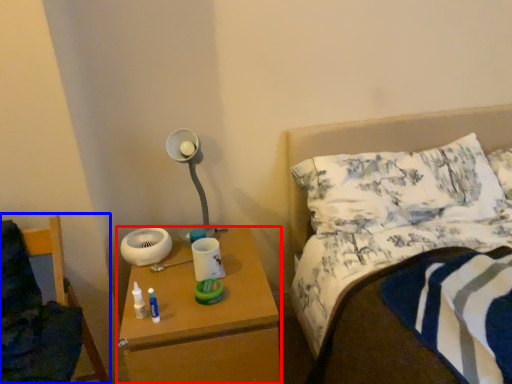
Question: Which object is further to the camera taking this photo, nightstand (highlighted by a red box) or furniture (highlighted by a blue box)?

Choices:
 (A) nightstand
 (B) furniture

Answer: (A)